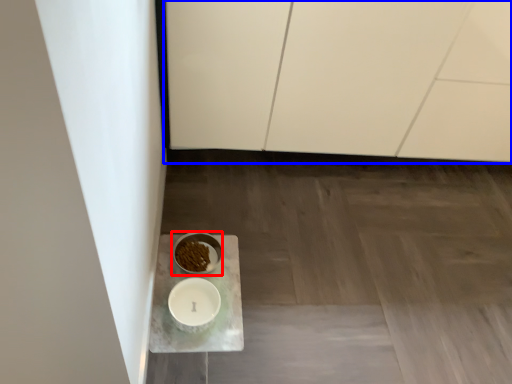
Question: Which of the following is the closest to the observer, tableware (highlighted by a red box) or cabinetry (highlighted by a blue box)?

Choices:
 (A) tableware
 (B) cabinetry

Answer: (B)